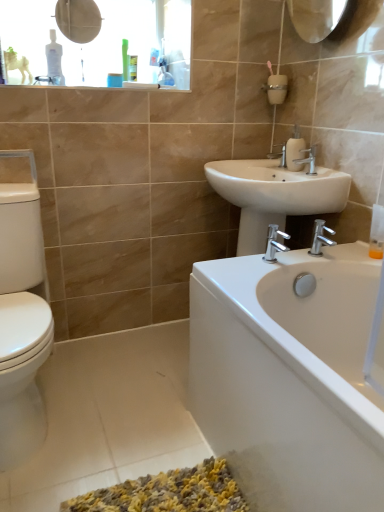
Question: Considering the positions of matte plastic medicine cabinet at upper left and white ceramic sink at center in the image, is matte plastic medicine cabinet at upper left taller or shorter than white ceramic sink at center?

Choices:
 (A) tall
 (B) short

Answer: (A)

Question: Looking at their shapes, would you say matte plastic medicine cabinet at upper left is wider or thinner than white ceramic sink at center?

Choices:
 (A) thin
 (B) wide

Answer: (A)

Question: Estimate the real-world distances between objects in this image. Which object is closer to the translucent plastic soap dispenser at right?

Choices:
 (A) white glossy bathtub at lower right
 (B) matte plastic medicine cabinet at upper left
 (C) white glossy soap dispenser at upper right
 (D) silver metallic faucet at upper center, which is the 1th tap in top-to-bottom order
 (E) silver metallic faucet at lower right, marked as the second tap in a back-to-front arrangement

Answer: (E)

Question: Which of these objects is positioned farthest from the silver metallic faucet at lower right, marked as the second tap in a back-to-front arrangement?

Choices:
 (A) matte plastic medicine cabinet at upper left
 (B) white glossy bathtub at lower right
 (C) silver metallic faucet at upper center, which is the 1th tap in top-to-bottom order
 (D) translucent plastic soap dispenser at right
 (E) white glossy soap dispenser at upper right

Answer: (A)